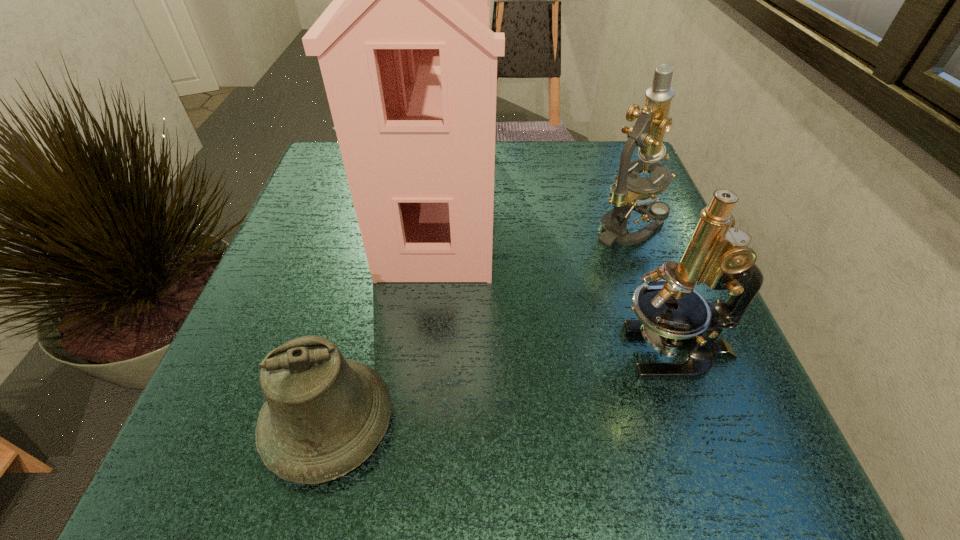
Locate an element on the screen. The width and height of the screenshot is (960, 540). object present at the far edge is located at coordinates point(409,63).

Locate an element on the screen. object located in the near edge section of the desktop is located at coordinates (324, 415).

Identify the location of object positioned at the left edge. This screenshot has height=540, width=960. (324, 415).

At what (x,y) coordinates should I click in order to perform the action: click on object present at the near left corner. Please return your answer as a coordinate pair (x, y). Looking at the image, I should click on (324, 415).

Where is `vacant area at the far edge of the desktop`? This screenshot has height=540, width=960. vacant area at the far edge of the desktop is located at coordinates (555, 171).

Where is `free region at the near edge of the desktop`? The width and height of the screenshot is (960, 540). free region at the near edge of the desktop is located at coordinates (614, 492).

Image resolution: width=960 pixels, height=540 pixels. I want to click on blank space at the left edge, so click(301, 206).

In the image, there is a desktop. Where is `vacant space at the right edge`? This screenshot has width=960, height=540. vacant space at the right edge is located at coordinates (642, 260).

Image resolution: width=960 pixels, height=540 pixels. In order to click on vacant area at the far left corner in this screenshot , I will do `click(325, 187)`.

The width and height of the screenshot is (960, 540). In the image, there is a desktop. Identify the location of vacant space at the near left corner. (257, 489).